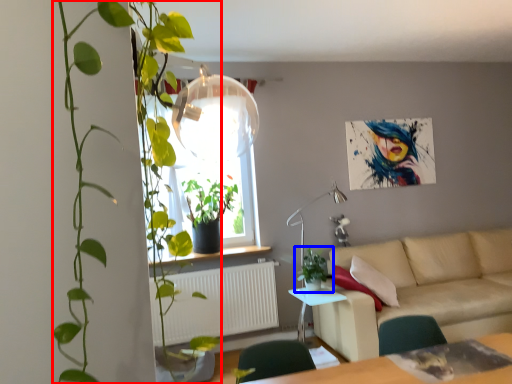
Question: Which of the following is the closest to the observer, houseplant (highlighted by a red box) or houseplant (highlighted by a blue box)?

Choices:
 (A) houseplant
 (B) houseplant

Answer: (A)